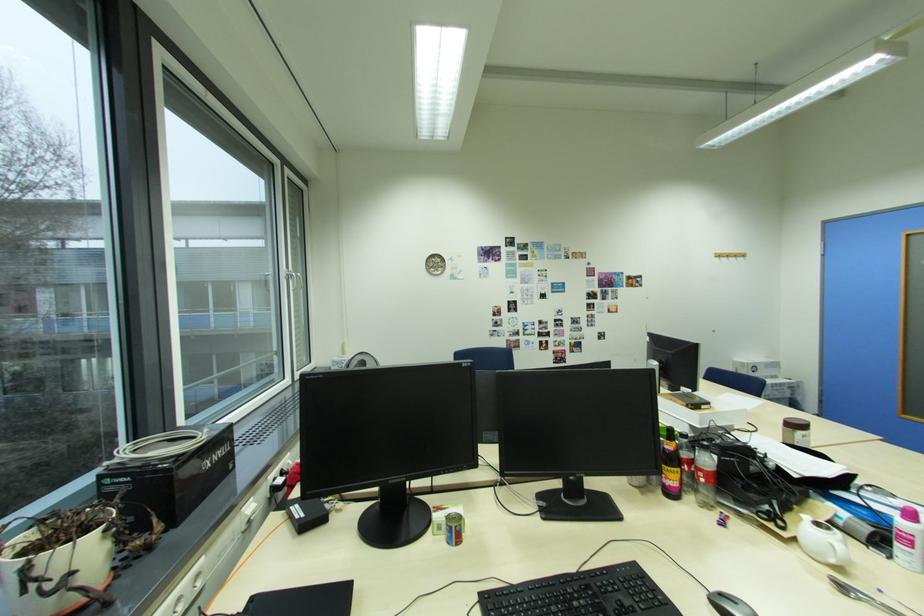
Identify the location of clear plastic bottle. (704, 476).